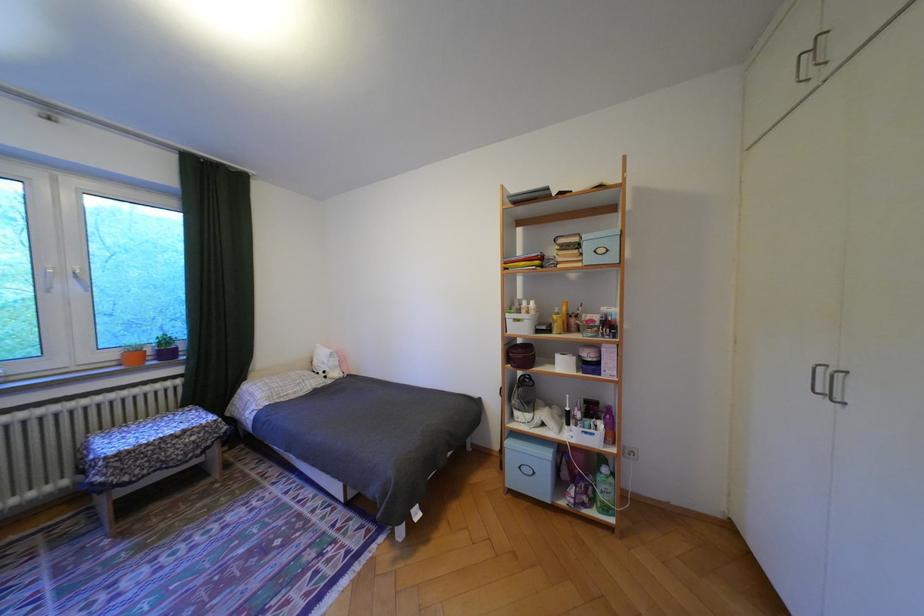
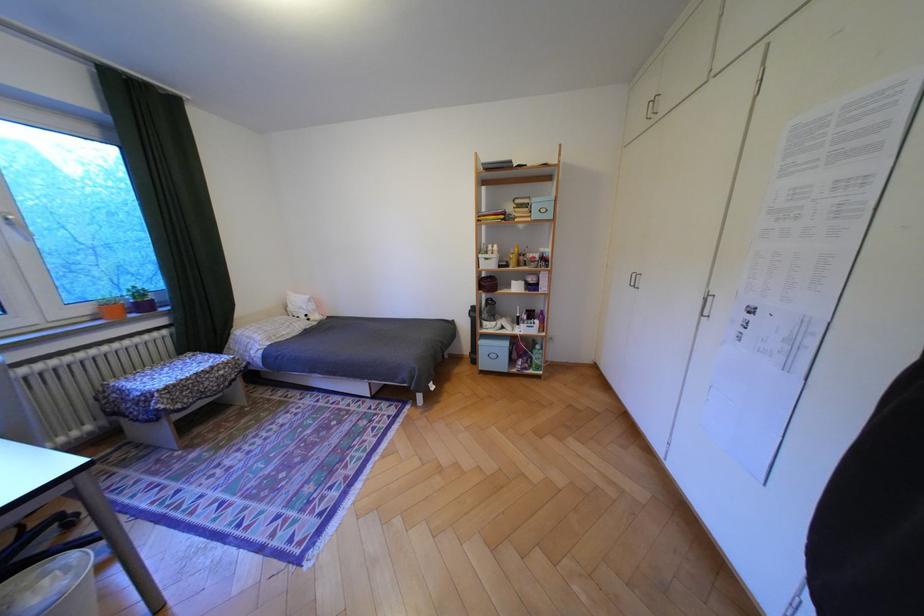
In the second image, find the point that corresponds to point (84, 280) in the first image.

(18, 227)